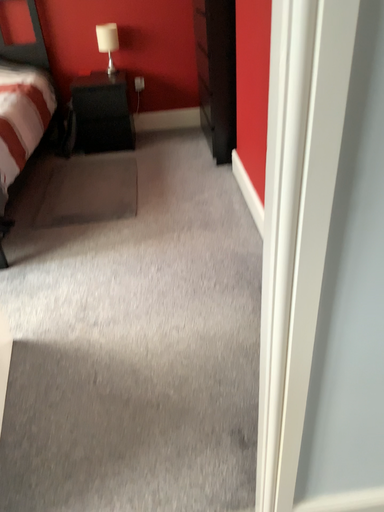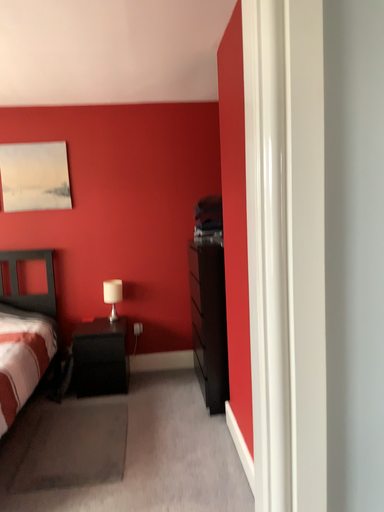
Question: Which way did the camera rotate in the video?

Choices:
 (A) rotated upward
 (B) rotated downward

Answer: (A)